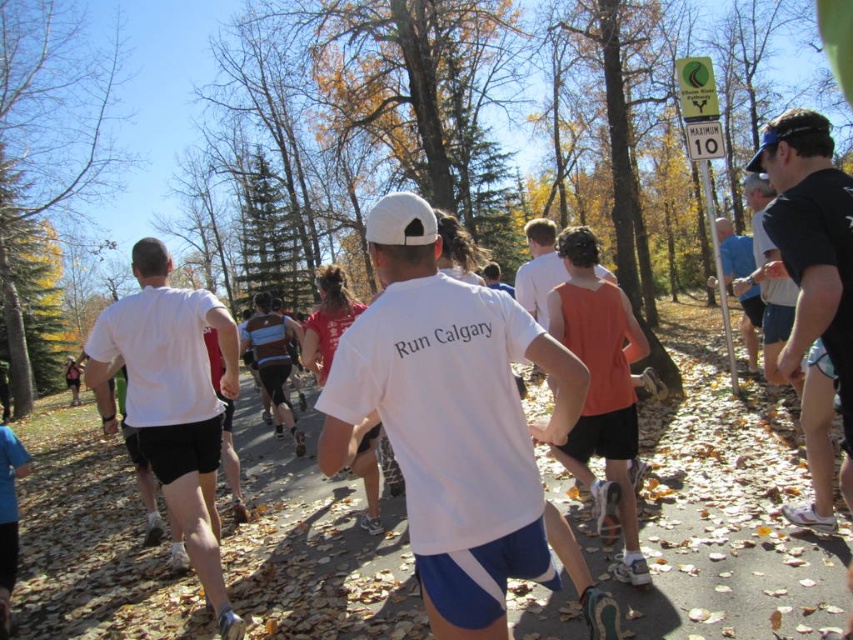
Who is taller, white matte t-shirt at center or black mesh shorts at right?

Standing taller between the two is white matte t-shirt at center.

Who is more forward, (393, 353) or (810, 515)?

Point (393, 353) is in front.

Where is `white matte t-shirt at center`? The width and height of the screenshot is (853, 640). white matte t-shirt at center is located at coordinates tap(456, 428).

This screenshot has width=853, height=640. Find the location of `white matte t-shirt at center`. white matte t-shirt at center is located at coordinates (456, 428).

Is orange cotton tank top at center shorter than blue fabric shirt at right?

In fact, orange cotton tank top at center may be taller than blue fabric shirt at right.

Does orange cotton tank top at center have a lesser width compared to blue fabric shirt at right?

Correct, orange cotton tank top at center's width is less than blue fabric shirt at right's.

Locate an element on the screen. The width and height of the screenshot is (853, 640). orange cotton tank top at center is located at coordinates (538, 269).

Is the position of orange fabric tank top at center more distant than that of blue fabric shirt at right?

That is False.

Measure the distance between point (614, 419) and camera.

Point (614, 419) and camera are 3.91 meters apart.

Locate an element on the screen. orange fabric tank top at center is located at coordinates (601, 387).